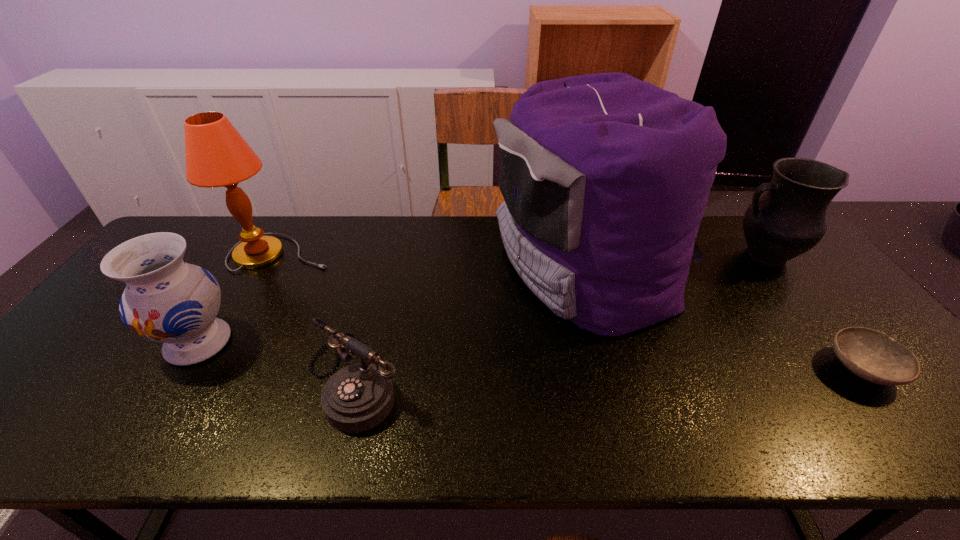
In order to click on pitcher present at the far edge in this screenshot , I will do `click(788, 220)`.

The height and width of the screenshot is (540, 960). I want to click on object that is at the near edge, so click(x=358, y=397).

Locate an element on the screen. This screenshot has width=960, height=540. pitcher that is at the right edge is located at coordinates (788, 220).

Where is `bowl present at the right edge`? The width and height of the screenshot is (960, 540). bowl present at the right edge is located at coordinates (874, 356).

Identify the location of object at the far right corner. [x=788, y=220].

This screenshot has height=540, width=960. In the image, there is a desktop. Identify the location of vacant space at the far edge. (353, 220).

You are a GUI agent. You are given a task and a screenshot of the screen. Output one action in this format:
    pyautogui.click(x=<x>, y=<y>)
    Task: Click on the free space at the near edge
    This screenshot has height=540, width=960.
    Given the screenshot: What is the action you would take?
    pyautogui.click(x=722, y=424)

Image resolution: width=960 pixels, height=540 pixels. I want to click on vacant space at the left edge, so click(88, 386).

Find the location of a particular element. The height and width of the screenshot is (540, 960). free space at the right edge of the desktop is located at coordinates (920, 393).

Where is `vacant space at the far left corner`? This screenshot has width=960, height=540. vacant space at the far left corner is located at coordinates (194, 221).